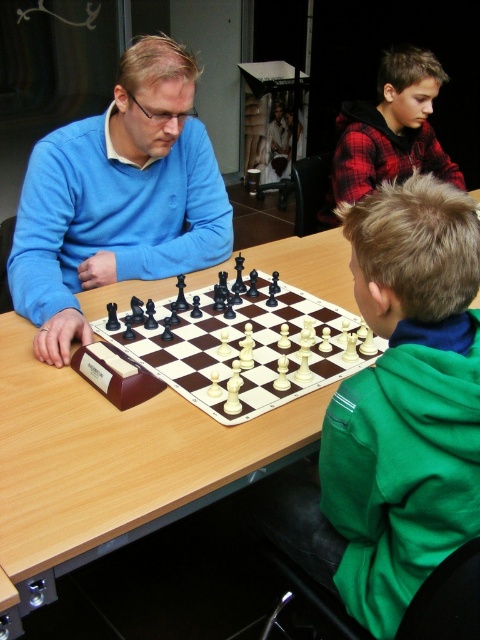
You are a photographer trying to capture a candid shot of both the matte blue sweater at left and the red plaid shirt at upper right. Based on their positions, which direction should you move your camera to include both subjects in the frame?

The matte blue sweater at left is positioned on the left side of red plaid shirt at upper right. To include both in the frame, move the camera to the left of the red plaid shirt at upper right to capture the matte blue sweater at left as well.

You are a chess player who wants to place a new chess piece on the wooden table at center. However, you notice the matte plastic chess set at center is already occupying the space. Can you place the new piece on the table without moving the existing chess set?

The wooden table at center is in front of the matte plastic chess set at center, meaning the chess set is placed on the table. Since the chess set is already occupying the space, you cannot place the new piece on the table without moving the existing chess set.